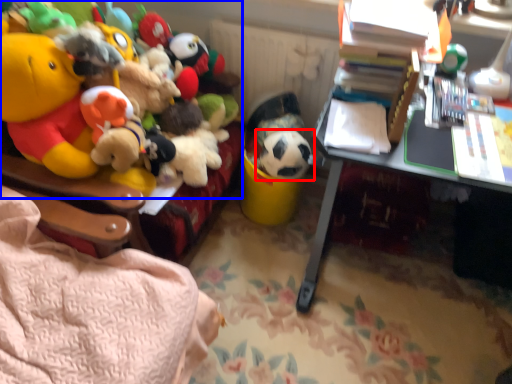
Question: Among these objects, which one is nearest to the camera, toy (highlighted by a red box) or toy (highlighted by a blue box)?

Choices:
 (A) toy
 (B) toy

Answer: (B)